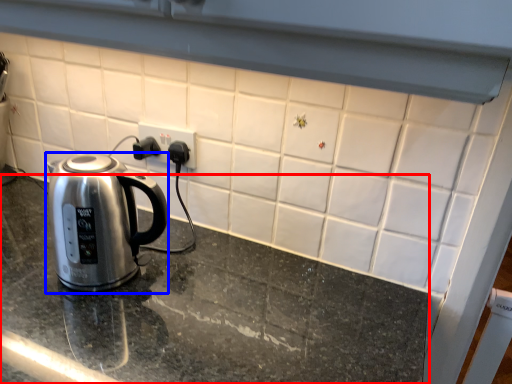
Question: Among these objects, which one is farthest to the camera, table top (highlighted by a red box) or kettle (highlighted by a blue box)?

Choices:
 (A) table top
 (B) kettle

Answer: (B)